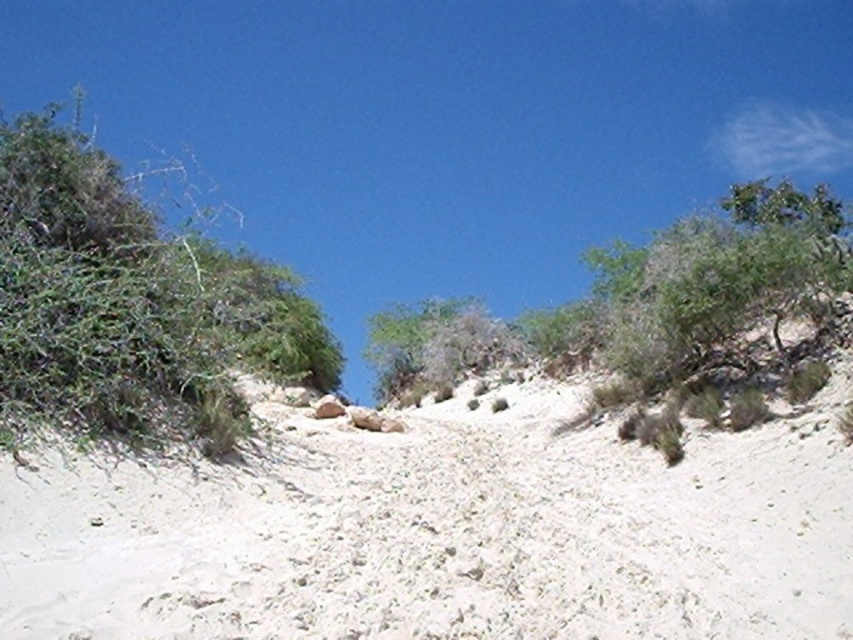
You are a drone operator trying to map the terrain. You need to mark the exact coordinates of the white sandy at center. What are its coordinates?

The coordinates of the white sandy at center are at point [440,531].